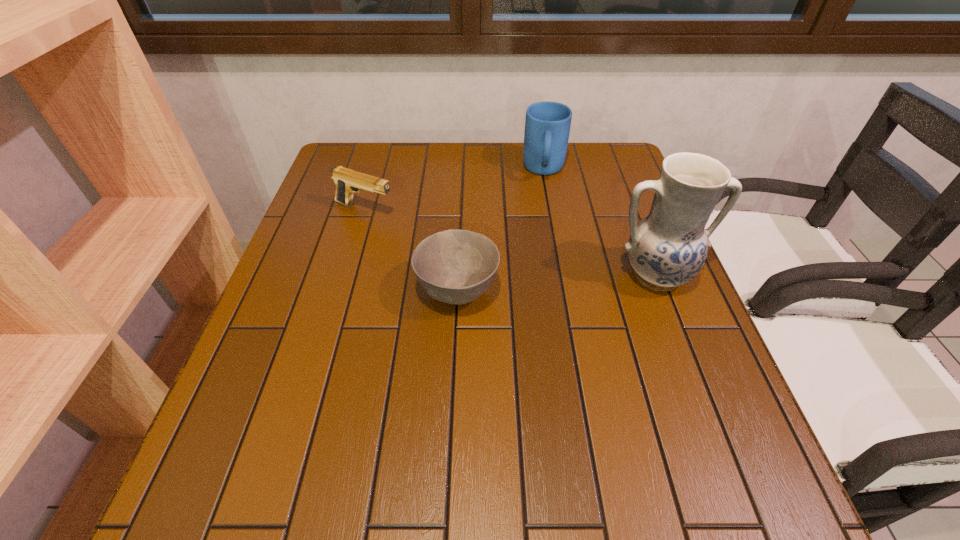
Locate an element on the screen. The image size is (960, 540). vacant space on the desktop that is between the bowl and the pottery and is positioned on the side of the third shortest object with the handle is located at coordinates (541, 284).

Locate an element on the screen. free space on the desktop that is between the bowl and the rightmost object and is positioned at the barrel of the pistol is located at coordinates (579, 281).